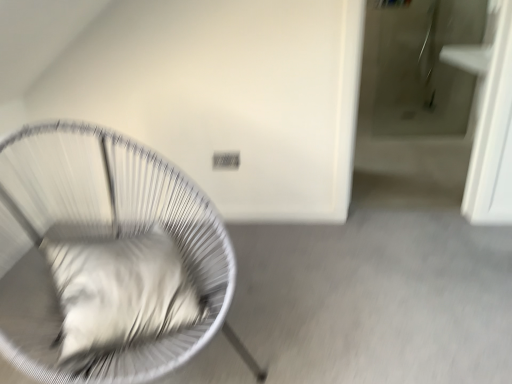
Question: Considering the positions of point pos(72,347) and point pos(176,200), is point pos(72,347) closer or farther from the camera than point pos(176,200)?

Choices:
 (A) closer
 (B) farther

Answer: (A)

Question: Based on their sizes in the image, would you say white soft pillow at left is bigger or smaller than white wire chair at left?

Choices:
 (A) big
 (B) small

Answer: (B)

Question: From the image's perspective, is white soft pillow at left positioned above or below white wire chair at left?

Choices:
 (A) below
 (B) above

Answer: (A)

Question: Considering the positions of white wire chair at left and white soft pillow at left in the image, is white wire chair at left wider or thinner than white soft pillow at left?

Choices:
 (A) thin
 (B) wide

Answer: (B)

Question: Is white wire chair at left taller or shorter than white soft pillow at left?

Choices:
 (A) tall
 (B) short

Answer: (A)

Question: Does point (51, 374) appear closer or farther from the camera than point (173, 329)?

Choices:
 (A) farther
 (B) closer

Answer: (A)

Question: Relative to white soft pillow at left, is white wire chair at left in front or behind?

Choices:
 (A) behind
 (B) front

Answer: (B)